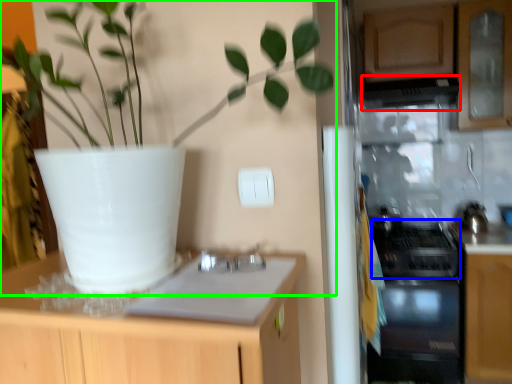
Question: Considering the real-world distances, which object is closest to exhaust hood (highlighted by a red box)? gas stove (highlighted by a blue box) or houseplant (highlighted by a green box).

Choices:
 (A) gas stove
 (B) houseplant

Answer: (A)